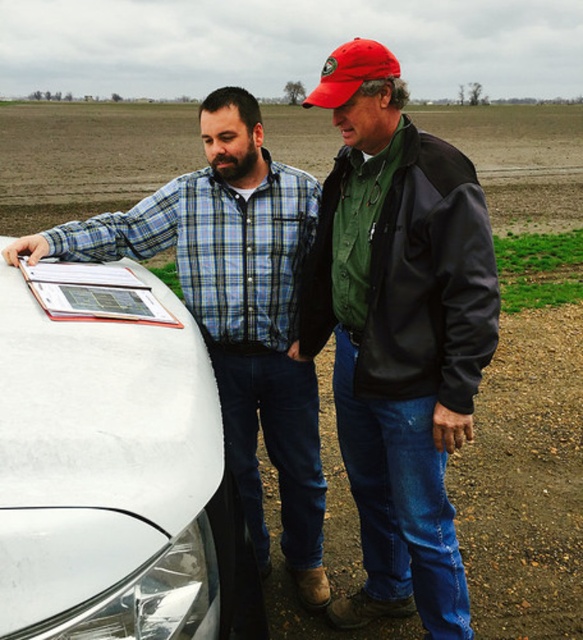
Can you confirm if green matte jacket at center is positioned to the left of matte black shirt at left?

Incorrect, green matte jacket at center is not on the left side of matte black shirt at left.

Locate an element on the screen. This screenshot has width=583, height=640. green matte jacket at center is located at coordinates (398, 333).

This screenshot has height=640, width=583. I want to click on green matte jacket at center, so click(x=398, y=333).